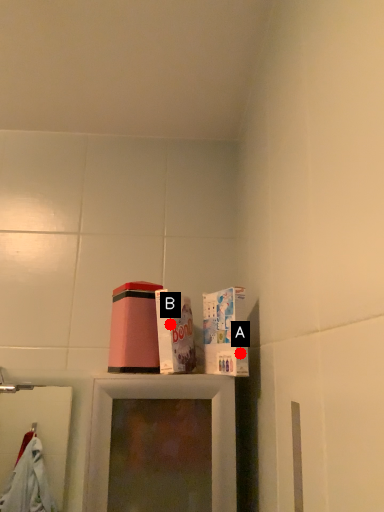
Question: Two points are circled on the image, labeled by A and B beside each circle. Which point is farther from the camera taking this photo?

Choices:
 (A) A is further
 (B) B is further

Answer: (B)